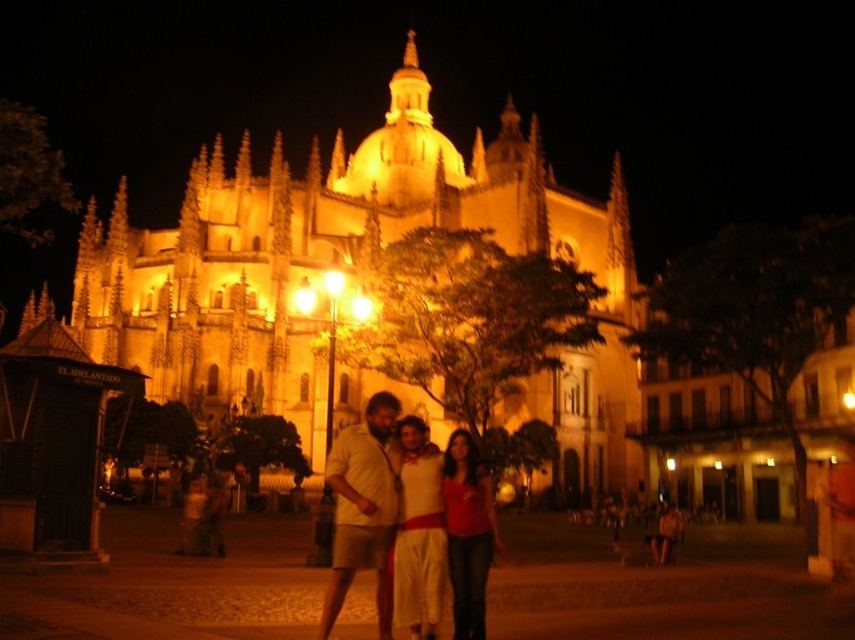
Between beige cotton shirt at center and matte red shirt at center, which one has less height?

matte red shirt at center is shorter.

Is point (384, 486) positioned after point (491, 544)?

No, (384, 486) is closer to viewer.

Image resolution: width=855 pixels, height=640 pixels. What are the coordinates of `beige cotton shirt at center` in the screenshot? It's located at (363, 508).

I want to click on beige cotton shirt at center, so click(x=363, y=508).

Between point (428, 509) and point (342, 570), which one is positioned in front?

Point (342, 570) is in front.

In order to click on white cotton dress at center in this screenshot , I will do tap(417, 532).

The image size is (855, 640). I want to click on white cotton dress at center, so coord(417,532).

How far apart are beige cotton shirt at center and matte beige shirt at center?

beige cotton shirt at center is 57.67 centimeters from matte beige shirt at center.

Does point (393, 412) lie in front of point (338, 499)?

No, it is not.

Is point (366, 512) farther from camera compared to point (328, 616)?

Yes, point (366, 512) is farther from viewer.

Locate an element on the screen. Image resolution: width=855 pixels, height=640 pixels. beige cotton shirt at center is located at coordinates (363, 508).